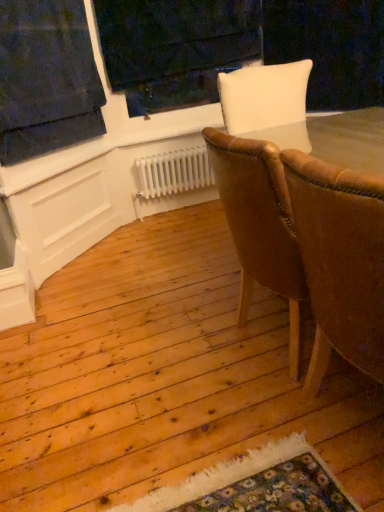
Question: Can you confirm if brown leather chair at right, which ranks as the 1th chair in front-to-back order, is taller than white painted wood at upper center?

Choices:
 (A) no
 (B) yes

Answer: (A)

Question: Are brown leather chair at right, which ranks as the 1th chair in front-to-back order, and white painted wood at upper center far apart?

Choices:
 (A) yes
 (B) no

Answer: (A)

Question: Can you confirm if brown leather chair at right, which ranks as the 1th chair in front-to-back order, is positioned to the right of white painted wood at upper center?

Choices:
 (A) yes
 (B) no

Answer: (A)

Question: Is brown leather chair at right, which ranks as the 1th chair in front-to-back order, directly adjacent to white painted wood at upper center?

Choices:
 (A) yes
 (B) no

Answer: (B)

Question: From the image's perspective, does brown leather chair at right, which ranks as the 1th chair in front-to-back order, appear lower than white painted wood at upper center?

Choices:
 (A) no
 (B) yes

Answer: (B)

Question: From the image's perspective, is dark blue fabric at upper left located above or below brown leather chair at right, acting as the 2th chair starting from the back?

Choices:
 (A) below
 (B) above

Answer: (B)

Question: Is dark blue fabric at upper left to the left or to the right of brown leather chair at right, acting as the 2th chair starting from the back, in the image?

Choices:
 (A) right
 (B) left

Answer: (B)

Question: Does point (26, 145) appear closer or farther from the camera than point (357, 253)?

Choices:
 (A) farther
 (B) closer

Answer: (A)

Question: Is dark blue fabric at upper left situated inside brown leather chair at right, acting as the 2th chair starting from the back, or outside?

Choices:
 (A) inside
 (B) outside

Answer: (B)

Question: Does point (104, 40) appear closer or farther from the camera than point (200, 181)?

Choices:
 (A) closer
 (B) farther

Answer: (A)

Question: From a real-world perspective, is white painted wood at upper center physically located above or below white metallic radiator at center?

Choices:
 (A) below
 (B) above

Answer: (B)

Question: Is white painted wood at upper center wider or thinner than white metallic radiator at center?

Choices:
 (A) thin
 (B) wide

Answer: (B)

Question: Considering their positions, is white painted wood at upper center located in front of or behind white metallic radiator at center?

Choices:
 (A) front
 (B) behind

Answer: (A)

Question: Is white painted wood at upper center taller or shorter than dark blue fabric at upper left?

Choices:
 (A) tall
 (B) short

Answer: (A)

Question: Is white painted wood at upper center bigger or smaller than dark blue fabric at upper left?

Choices:
 (A) big
 (B) small

Answer: (A)